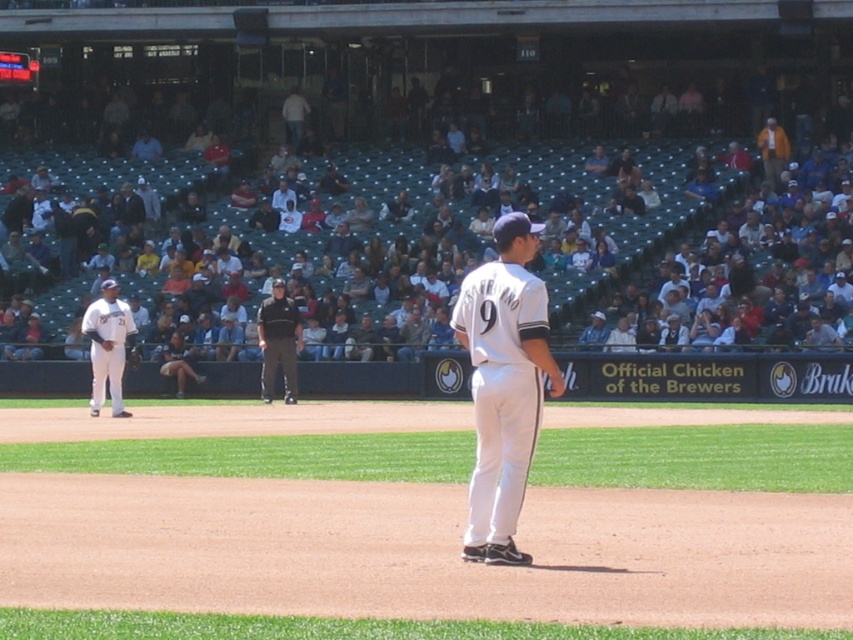
Question: Is light brown leather jacket at upper center above brown leather glove at center?

Choices:
 (A) no
 (B) yes

Answer: (B)

Question: Which point is farther to the camera?

Choices:
 (A) (287, 97)
 (B) (434, 422)
 (C) (563, 188)

Answer: (A)

Question: Which object appears farthest from the camera in this image?

Choices:
 (A) black uniformed man at center
 (B) white matte baseball uniform at left

Answer: (A)

Question: Which point is closer to the camera?

Choices:
 (A) (132, 328)
 (B) (604, 412)
 (C) (761, 145)

Answer: (A)

Question: Is orange cotton shirt at upper right wider than light brown leather jacket at upper center?

Choices:
 (A) yes
 (B) no

Answer: (B)

Question: From the image, what is the correct spatial relationship of white uniform pants at center in relation to orange cotton shirt at upper right?

Choices:
 (A) right
 (B) left

Answer: (B)